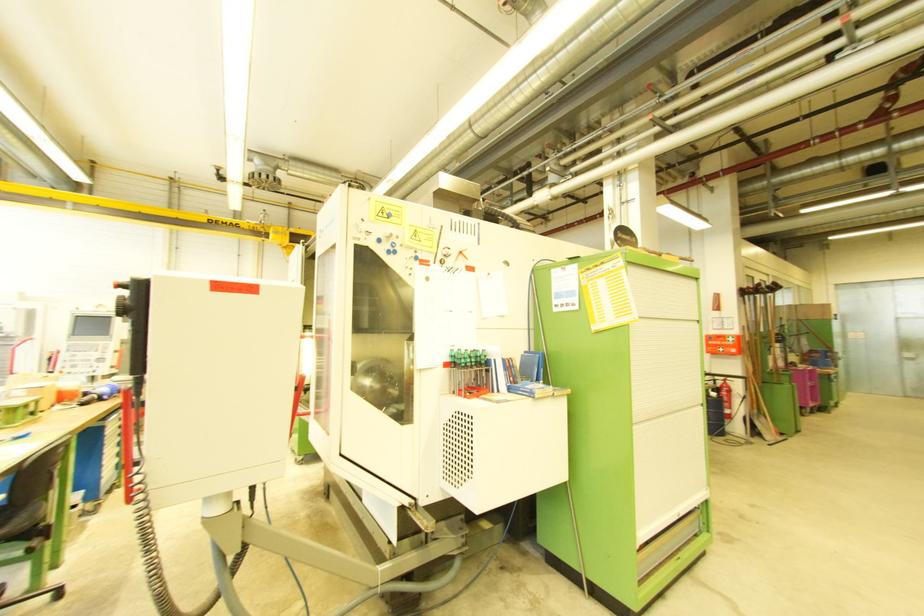
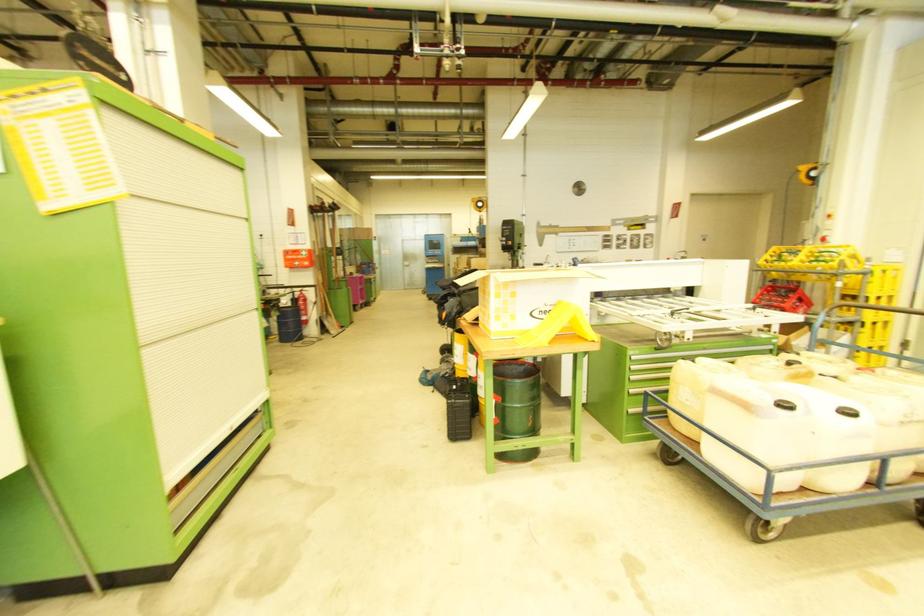
Find the pixel in the second image that matches (723,352) in the first image.

(299, 265)